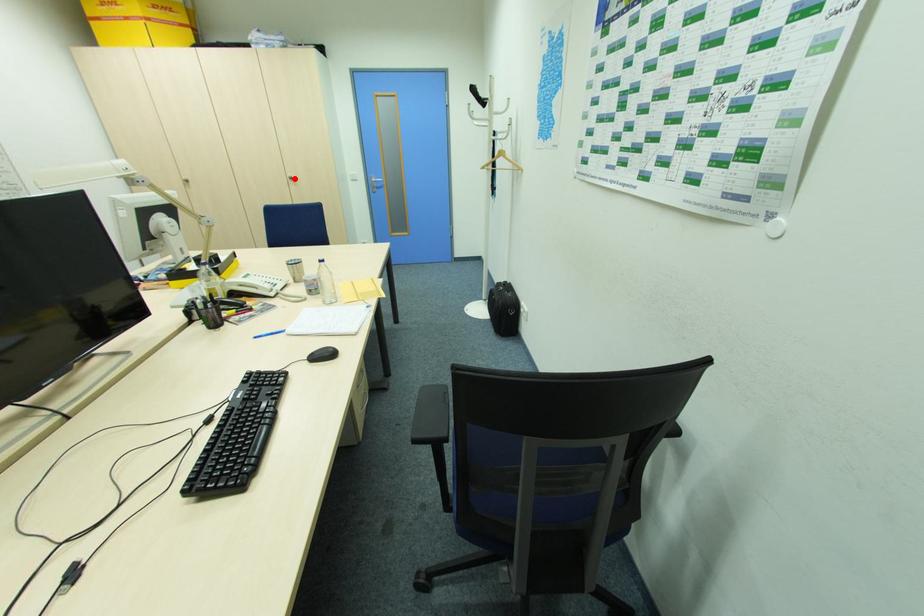
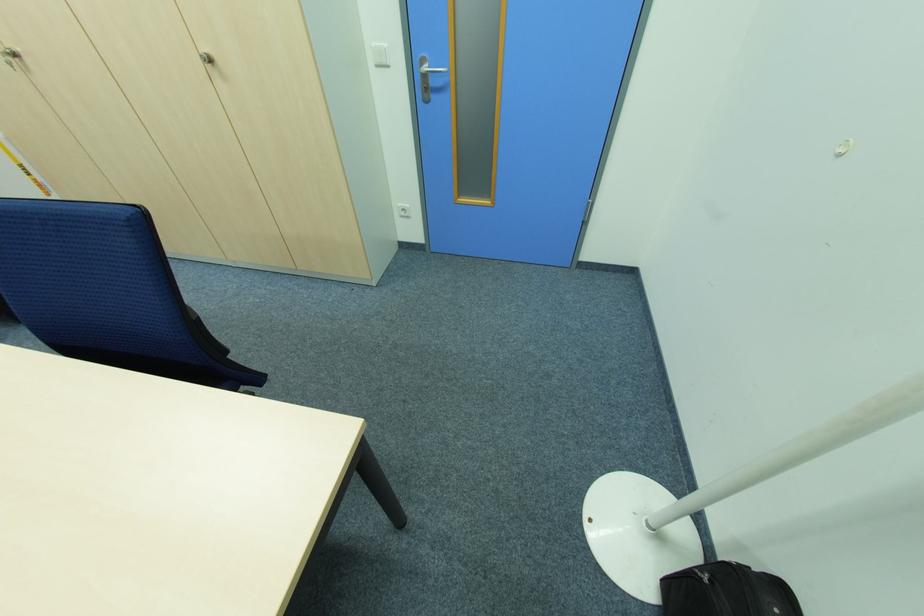
The point at the highlighted location is marked in the first image. Where is the corresponding point in the second image?

(213, 62)